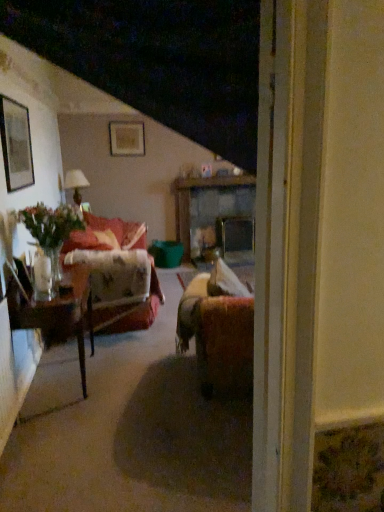
Question: Should I look upward or downward to see wooden table at center, which is the 2th table from bottom to top?

Choices:
 (A) up
 (B) down

Answer: (A)

Question: Is matte gold picture frame at upper center, which ranks as the first picture frame in top-to-bottom order, a part of matte black picture frame at upper left, the 2th picture frame in the top-to-bottom sequence?

Choices:
 (A) yes
 (B) no

Answer: (B)

Question: Is matte black picture frame at upper left, the 1th picture frame positioned from the left, not close to matte gold picture frame at upper center, which is counted as the 1th picture frame, starting from the right?

Choices:
 (A) no
 (B) yes

Answer: (B)

Question: Is matte black picture frame at upper left, the 1th picture frame positioned from the left, taller than matte gold picture frame at upper center, the 2th picture frame in the left-to-right sequence?

Choices:
 (A) yes
 (B) no

Answer: (A)

Question: Is matte black picture frame at upper left, the 1th picture frame positioned from the left, located outside matte gold picture frame at upper center, which is counted as the 1th picture frame, starting from the right?

Choices:
 (A) no
 (B) yes

Answer: (B)

Question: Does matte black picture frame at upper left, marked as the 2th picture frame in a back-to-front arrangement, have a smaller size compared to matte gold picture frame at upper center, which ranks as the first picture frame in top-to-bottom order?

Choices:
 (A) no
 (B) yes

Answer: (A)

Question: Is matte black picture frame at upper left, the 1th picture frame positioned from the left, oriented away from matte gold picture frame at upper center, which ranks as the first picture frame in top-to-bottom order?

Choices:
 (A) yes
 (B) no

Answer: (B)

Question: Would you say matte white lampshade at left is outside velvet red couch at left?

Choices:
 (A) yes
 (B) no

Answer: (A)

Question: From a real-world perspective, is matte white lampshade at left physically below velvet red couch at left?

Choices:
 (A) no
 (B) yes

Answer: (A)

Question: Is matte white lampshade at left positioned far away from velvet red couch at left?

Choices:
 (A) yes
 (B) no

Answer: (A)

Question: Can you confirm if matte white lampshade at left is shorter than velvet red couch at left?

Choices:
 (A) yes
 (B) no

Answer: (A)

Question: From the image's perspective, is matte white lampshade at left located above velvet red couch at left?

Choices:
 (A) yes
 (B) no

Answer: (A)

Question: Considering the relative sizes of matte white lampshade at left and velvet red couch at left in the image provided, is matte white lampshade at left smaller than velvet red couch at left?

Choices:
 (A) no
 (B) yes

Answer: (B)

Question: Is wooden glossy table at left, the second table when ordered from top to bottom, not close to velvet red couch at left?

Choices:
 (A) yes
 (B) no

Answer: (A)